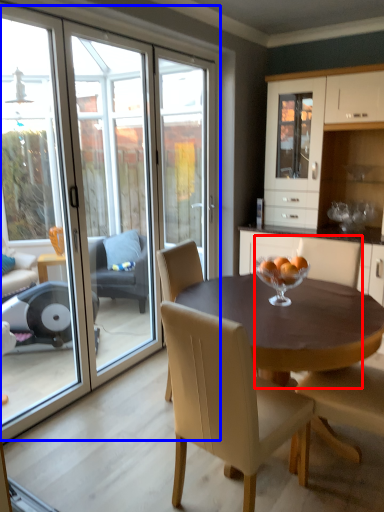
Question: Which object appears closest to the camera in this image, chair (highlighted by a red box) or glass door (highlighted by a blue box)?

Choices:
 (A) chair
 (B) glass door

Answer: (B)